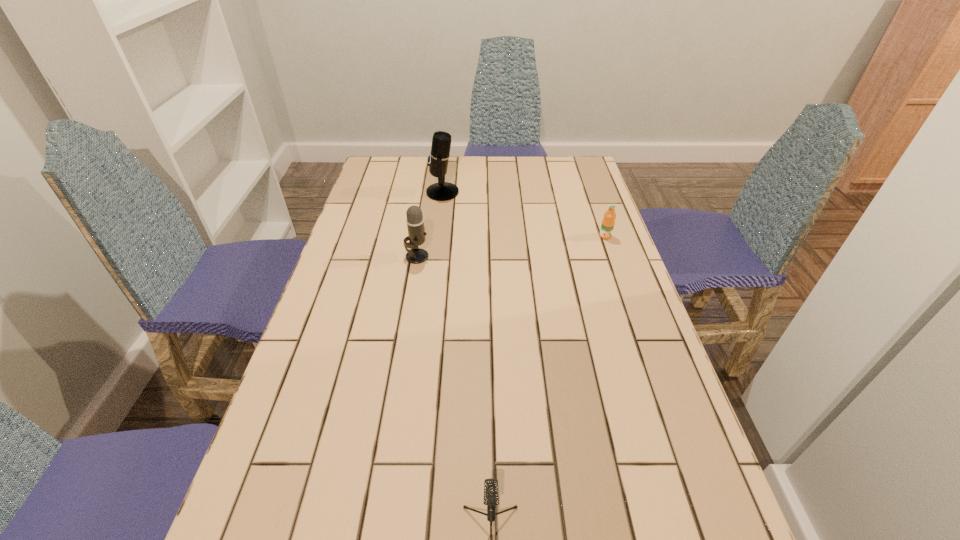
The image size is (960, 540). I want to click on the farthest object, so coord(439,156).

You are a GUI agent. You are given a task and a screenshot of the screen. Output one action in this format:
    pyautogui.click(x=<x>, y=<y>)
    Task: Click on the farthest microphone
    This screenshot has height=540, width=960.
    Given the screenshot: What is the action you would take?
    pyautogui.click(x=439, y=156)

Locate an element on the screen. This screenshot has height=540, width=960. the second nearest microphone is located at coordinates (415, 223).

This screenshot has width=960, height=540. In order to click on the second shortest microphone in this screenshot , I will do `click(415, 223)`.

Where is `the second farthest object`? This screenshot has width=960, height=540. the second farthest object is located at coordinates (608, 221).

Where is `the rightmost object`? the rightmost object is located at coordinates (608, 221).

Locate an element on the screen. This screenshot has height=540, width=960. vacant space located 0.200m on the back of the farthest object is located at coordinates (446, 158).

This screenshot has width=960, height=540. I want to click on vacant space located on the back of the third farthest object, so click(424, 212).

This screenshot has width=960, height=540. Find the location of `free space located 0.200m on the label of the orange juice`. free space located 0.200m on the label of the orange juice is located at coordinates (622, 286).

Where is `object located at the far edge`? The width and height of the screenshot is (960, 540). object located at the far edge is located at coordinates pyautogui.click(x=439, y=156).